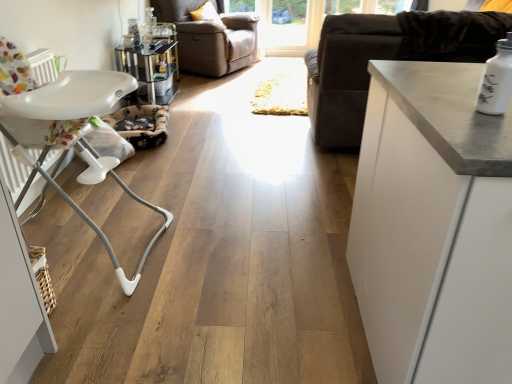
Question: Is transparent glass door at upper center, which is the 1th window screen in left-to-right order, oriented away from transparent glass window at upper center, marked as the 1th window screen in a right-to-left arrangement?

Choices:
 (A) no
 (B) yes

Answer: (B)

Question: Considering the relative positions of transparent glass door at upper center, the second window screen from the right, and transparent glass window at upper center, which is the second window screen from left to right, in the image provided, is transparent glass door at upper center, the second window screen from the right, to the right of transparent glass window at upper center, which is the second window screen from left to right, from the viewer's perspective?

Choices:
 (A) no
 (B) yes

Answer: (A)

Question: Does transparent glass door at upper center, the second window screen from the right, have a greater width compared to transparent glass window at upper center, which is the second window screen from left to right?

Choices:
 (A) yes
 (B) no

Answer: (A)

Question: From the image's perspective, is transparent glass door at upper center, the second window screen from the right, below transparent glass window at upper center, marked as the 1th window screen in a right-to-left arrangement?

Choices:
 (A) no
 (B) yes

Answer: (A)

Question: Could you tell me if transparent glass door at upper center, the second window screen from the right, is facing transparent glass window at upper center, marked as the 1th window screen in a right-to-left arrangement?

Choices:
 (A) yes
 (B) no

Answer: (A)

Question: Choose the correct answer: Is transparent glass door at upper center, which is the 1th window screen in left-to-right order, inside white matte cabinet at upper right or outside it?

Choices:
 (A) outside
 (B) inside

Answer: (A)

Question: Considering the relative positions of transparent glass door at upper center, which is the 1th window screen in left-to-right order, and white matte cabinet at upper right in the image provided, is transparent glass door at upper center, which is the 1th window screen in left-to-right order, to the left or to the right of white matte cabinet at upper right?

Choices:
 (A) left
 (B) right

Answer: (A)

Question: In terms of height, does transparent glass door at upper center, which is the 1th window screen in left-to-right order, look taller or shorter compared to white matte cabinet at upper right?

Choices:
 (A) short
 (B) tall

Answer: (A)

Question: From a real-world perspective, is transparent glass door at upper center, which is the 1th window screen in left-to-right order, above or below white matte cabinet at upper right?

Choices:
 (A) above
 (B) below

Answer: (B)

Question: Is velvet dark brown couch at right wider or thinner than beige leather armchair at upper center?

Choices:
 (A) thin
 (B) wide

Answer: (B)

Question: From the image's perspective, is velvet dark brown couch at right located above or below beige leather armchair at upper center?

Choices:
 (A) above
 (B) below

Answer: (B)

Question: Considering the positions of velvet dark brown couch at right and beige leather armchair at upper center in the image, is velvet dark brown couch at right bigger or smaller than beige leather armchair at upper center?

Choices:
 (A) big
 (B) small

Answer: (A)

Question: From a real-world perspective, is velvet dark brown couch at right physically located above or below beige leather armchair at upper center?

Choices:
 (A) above
 (B) below

Answer: (A)

Question: Considering their positions, is transparent glass window at upper center, marked as the 1th window screen in a right-to-left arrangement, located in front of or behind metallic glass table at upper center?

Choices:
 (A) behind
 (B) front

Answer: (A)

Question: Considering the positions of transparent glass window at upper center, which is the second window screen from left to right, and metallic glass table at upper center in the image, is transparent glass window at upper center, which is the second window screen from left to right, wider or thinner than metallic glass table at upper center?

Choices:
 (A) wide
 (B) thin

Answer: (B)